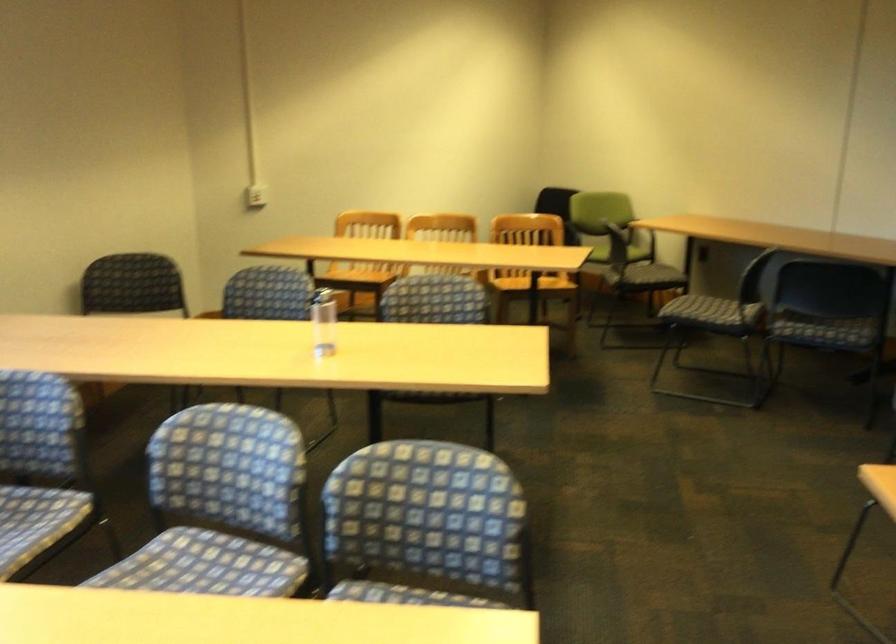
Find the location of `wooden chair sitting surface`. wooden chair sitting surface is located at coordinates (721, 316).